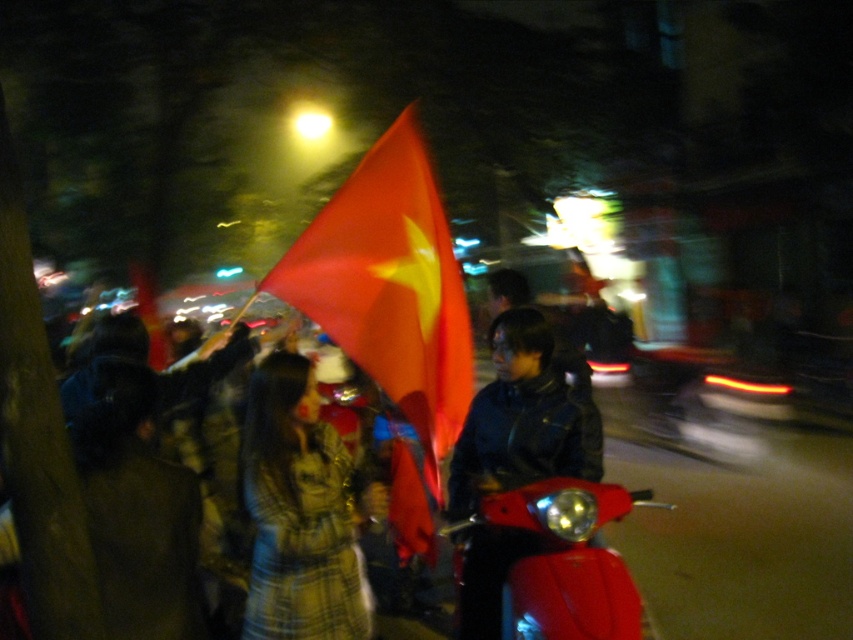
Who is higher up, plaid wool coat at center or shiny red motorbike at lower right?

Positioned higher is plaid wool coat at center.

Who is lower down, plaid wool coat at center or shiny red motorbike at lower right?

shiny red motorbike at lower right

Measure the distance between plaid wool coat at center and camera.

plaid wool coat at center and camera are 2.56 meters apart from each other.

The image size is (853, 640). What are the coordinates of `plaid wool coat at center` in the screenshot? It's located at point(299,513).

Which is above, plaid wool coat at center or shiny black jacket at center?

shiny black jacket at center is above.

Between point (287, 564) and point (474, 552), which one is positioned behind?

The point (474, 552) is more distant.

Find the location of `plaid wool coat at center`. plaid wool coat at center is located at coordinates pos(299,513).

Is matte red flag at center below shiny black jacket at center?

No, matte red flag at center is not below shiny black jacket at center.

Which is behind, point (432, 340) or point (451, 464)?

The point (432, 340) is more distant.

This screenshot has height=640, width=853. Describe the element at coordinates (389, 285) in the screenshot. I see `matte red flag at center` at that location.

The height and width of the screenshot is (640, 853). Find the location of `matte red flag at center`. matte red flag at center is located at coordinates (389, 285).